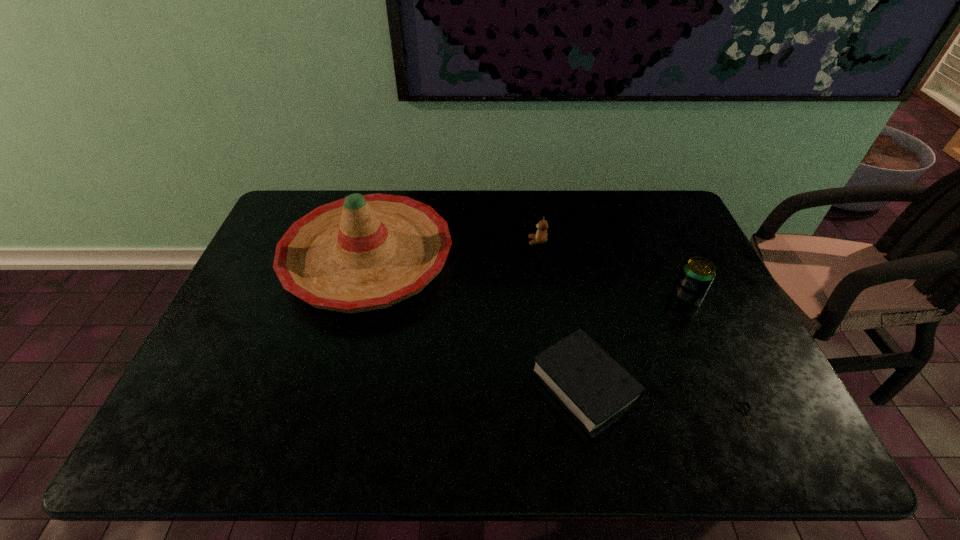
Where is `vacant space located 0.050m on the front-facing side of the teddy bear`? vacant space located 0.050m on the front-facing side of the teddy bear is located at coordinates (513, 241).

At what (x,y) coordinates should I click in order to perform the action: click on vacant region located on the left of the Bible. Please return your answer as a coordinate pair (x, y). Looking at the image, I should click on (400, 386).

Locate an element on the screen. This screenshot has height=540, width=960. free location located on the left of the shortest object is located at coordinates (660, 421).

I want to click on object located at the far edge, so click(361, 253).

The height and width of the screenshot is (540, 960). I want to click on Bible located at the near edge, so click(593, 387).

The image size is (960, 540). I want to click on shears that is at the near edge, so click(x=745, y=411).

In order to click on object situated at the left edge in this screenshot , I will do pyautogui.click(x=361, y=253).

Where is `beer can that is positioned at the right edge`? beer can that is positioned at the right edge is located at coordinates [697, 273].

I want to click on shears that is at the right edge, so click(745, 411).

Identify the location of object located in the far left corner section of the desktop. (361, 253).